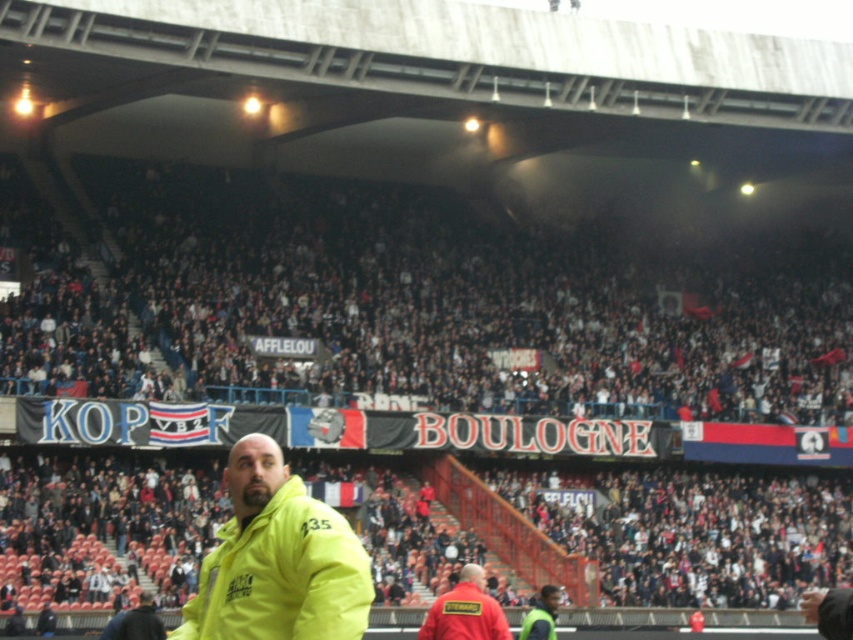
Is red fabric steward at lower center in front of yellow jacket at center?

Yes, it is.

Between point (479, 572) and point (550, 596), which one is positioned behind?

Positioned behind is point (550, 596).

The width and height of the screenshot is (853, 640). Find the location of `red fabric steward at lower center`. red fabric steward at lower center is located at coordinates (465, 611).

Locate an element on the screen. yellow matte jacket at center is located at coordinates (277, 561).

Can you confirm if yellow matte jacket at center is shorter than yellow jacket at lower center?

No, yellow matte jacket at center is not shorter than yellow jacket at lower center.

The image size is (853, 640). Find the location of `yellow matte jacket at center`. yellow matte jacket at center is located at coordinates (277, 561).

Describe the element at coordinates (277, 561) in the screenshot. This screenshot has width=853, height=640. I see `yellow matte jacket at center` at that location.

Can you confirm if yellow matte jacket at center is taller than yellow jacket at center?

Correct, yellow matte jacket at center is much taller as yellow jacket at center.

I want to click on yellow matte jacket at center, so click(x=277, y=561).